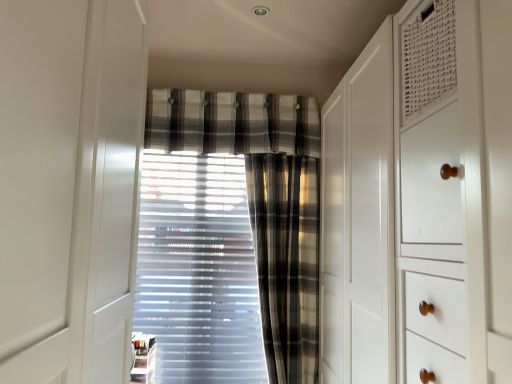
The image size is (512, 384). Describe the element at coordinates (286, 261) in the screenshot. I see `plaid fabric curtain at center, which is counted as the first curtain, starting from the right` at that location.

What is the approximate width of plaid fabric curtain at center, positioned as the 2th curtain in left-to-right order?

The width of plaid fabric curtain at center, positioned as the 2th curtain in left-to-right order, is 6.33 inches.

Image resolution: width=512 pixels, height=384 pixels. I want to click on plaid fabric curtain at center, which is the first curtain in left-to-right order, so click(x=230, y=236).

What do you see at coordinates (231, 122) in the screenshot?
I see `plaid fabric at center` at bounding box center [231, 122].

Find the location of a particular element. plaid fabric curtain at center, which is counted as the first curtain, starting from the right is located at coordinates (286, 261).

Does plaid fabric curtain at center, which is counted as the first curtain, starting from the right, have a lesser height compared to plaid fabric curtain at center, arranged as the 2th curtain when viewed from the right?

No.

Are plaid fabric curtain at center, which is counted as the first curtain, starting from the right, and plaid fabric curtain at center, arranged as the 2th curtain when viewed from the right, far apart?

No, plaid fabric curtain at center, which is counted as the first curtain, starting from the right, is not far away from plaid fabric curtain at center, arranged as the 2th curtain when viewed from the right.

Is plaid fabric curtain at center, positioned as the 2th curtain in left-to-right order, facing away from plaid fabric curtain at center, arranged as the 2th curtain when viewed from the right?

plaid fabric curtain at center, positioned as the 2th curtain in left-to-right order, is not turned away from plaid fabric curtain at center, arranged as the 2th curtain when viewed from the right.

Is plaid fabric curtain at center, which is the first curtain in left-to-right order, not within plaid fabric curtain at center, positioned as the 2th curtain in left-to-right order?

Yes, plaid fabric curtain at center, which is the first curtain in left-to-right order, is located beyond the bounds of plaid fabric curtain at center, positioned as the 2th curtain in left-to-right order.

Is plaid fabric curtain at center, which is the first curtain in left-to-right order, positioned with its back to plaid fabric curtain at center, positioned as the 2th curtain in left-to-right order?

No, plaid fabric curtain at center, which is the first curtain in left-to-right order,'s orientation is not away from plaid fabric curtain at center, positioned as the 2th curtain in left-to-right order.

Which is more to the left, plaid fabric curtain at center, which is the first curtain in left-to-right order, or plaid fabric curtain at center, which is counted as the first curtain, starting from the right?

plaid fabric curtain at center, which is the first curtain in left-to-right order.

Is plaid fabric curtain at center, which is the first curtain in left-to-right order, in front of or behind plaid fabric curtain at center, which is counted as the first curtain, starting from the right, in the image?

Clearly, plaid fabric curtain at center, which is the first curtain in left-to-right order, is behind plaid fabric curtain at center, which is counted as the first curtain, starting from the right.

You are a GUI agent. You are given a task and a screenshot of the screen. Output one action in this format:
    pyautogui.click(x=<x>, y=<y>)
    Task: Click on the curtain to the left of plaid fabric at center
    This screenshot has width=512, height=384.
    Given the screenshot: What is the action you would take?
    pyautogui.click(x=230, y=236)

From a real-world perspective, between plaid fabric curtain at center, arranged as the 2th curtain when viewed from the right, and plaid fabric at center, who is vertically lower?

From a 3D spatial view, plaid fabric curtain at center, arranged as the 2th curtain when viewed from the right, is below.

Could you tell me if plaid fabric curtain at center, arranged as the 2th curtain when viewed from the right, is turned towards plaid fabric at center?

No, plaid fabric curtain at center, arranged as the 2th curtain when viewed from the right, is not turned towards plaid fabric at center.

Considering the positions of points (308, 301) and (227, 118), is point (308, 301) closer to camera compared to point (227, 118)?

Yes, point (308, 301) is closer to viewer.

Considering the relative sizes of plaid fabric curtain at center, positioned as the 2th curtain in left-to-right order, and plaid fabric at center in the image provided, is plaid fabric curtain at center, positioned as the 2th curtain in left-to-right order, thinner than plaid fabric at center?

No, plaid fabric curtain at center, positioned as the 2th curtain in left-to-right order, is not thinner than plaid fabric at center.

Based on the photo, could you tell me if plaid fabric curtain at center, positioned as the 2th curtain in left-to-right order, is facing plaid fabric at center?

No, plaid fabric curtain at center, positioned as the 2th curtain in left-to-right order, is not turned towards plaid fabric at center.

Which of these two, plaid fabric curtain at center, positioned as the 2th curtain in left-to-right order, or plaid fabric at center, is smaller?

plaid fabric at center.

Does plaid fabric at center have a larger size compared to plaid fabric curtain at center, which is counted as the first curtain, starting from the right?

No, plaid fabric at center is not bigger than plaid fabric curtain at center, which is counted as the first curtain, starting from the right.

From a real-world perspective, which is physically below, plaid fabric at center or plaid fabric curtain at center, positioned as the 2th curtain in left-to-right order?

From a 3D spatial view, plaid fabric curtain at center, positioned as the 2th curtain in left-to-right order, is below.

From the image's perspective, is plaid fabric at center on plaid fabric curtain at center, positioned as the 2th curtain in left-to-right order?

Yes.

Is plaid fabric at center not within plaid fabric curtain at center, positioned as the 2th curtain in left-to-right order?

Yes, plaid fabric at center is outside of plaid fabric curtain at center, positioned as the 2th curtain in left-to-right order.

Would you say plaid fabric at center is outside plaid fabric curtain at center, arranged as the 2th curtain when viewed from the right?

Yes, plaid fabric at center is outside of plaid fabric curtain at center, arranged as the 2th curtain when viewed from the right.

Could you measure the distance between plaid fabric at center and plaid fabric curtain at center, arranged as the 2th curtain when viewed from the right?

They are 12.41 inches apart.

Is plaid fabric at center smaller than plaid fabric curtain at center, arranged as the 2th curtain when viewed from the right?

Yes.

From the image's perspective, which is above, plaid fabric at center or plaid fabric curtain at center, which is the first curtain in left-to-right order?

plaid fabric at center, from the image's perspective.

I want to click on curtain below the plaid fabric curtain at center, positioned as the 2th curtain in left-to-right order (from a real-world perspective), so click(x=230, y=236).

Where is `curtain in front of the plaid fabric curtain at center, which is the first curtain in left-to-right order`? The image size is (512, 384). curtain in front of the plaid fabric curtain at center, which is the first curtain in left-to-right order is located at coordinates (286, 261).

In the scene shown: Estimate the real-world distances between objects in this image. Which object is closer to plaid fabric at center, plaid fabric curtain at center, arranged as the 2th curtain when viewed from the right, or plaid fabric curtain at center, positioned as the 2th curtain in left-to-right order?

plaid fabric curtain at center, arranged as the 2th curtain when viewed from the right.

Based on their spatial positions, is plaid fabric curtain at center, which is the first curtain in left-to-right order, or plaid fabric at center further from plaid fabric curtain at center, which is counted as the first curtain, starting from the right?

Based on the image, plaid fabric at center appears to be further to plaid fabric curtain at center, which is counted as the first curtain, starting from the right.

Looking at the image, which one is located further to plaid fabric at center, plaid fabric curtain at center, positioned as the 2th curtain in left-to-right order, or plaid fabric curtain at center, arranged as the 2th curtain when viewed from the right?

Based on the image, plaid fabric curtain at center, positioned as the 2th curtain in left-to-right order, appears to be further to plaid fabric at center.

Looking at the image, which one is located further to plaid fabric curtain at center, arranged as the 2th curtain when viewed from the right, plaid fabric curtain at center, positioned as the 2th curtain in left-to-right order, or plaid fabric at center?

plaid fabric at center lies further to plaid fabric curtain at center, arranged as the 2th curtain when viewed from the right, than the other object.

When comparing their distances from plaid fabric curtain at center, arranged as the 2th curtain when viewed from the right, does plaid fabric at center or plaid fabric curtain at center, positioned as the 2th curtain in left-to-right order, seem further?

plaid fabric at center is further to plaid fabric curtain at center, arranged as the 2th curtain when viewed from the right.

Based on the photo, based on their spatial positions, is plaid fabric at center or plaid fabric curtain at center, arranged as the 2th curtain when viewed from the right, closer to plaid fabric curtain at center, which is counted as the first curtain, starting from the right?

Among the two, plaid fabric curtain at center, arranged as the 2th curtain when viewed from the right, is located nearer to plaid fabric curtain at center, which is counted as the first curtain, starting from the right.

The image size is (512, 384). Find the location of `curtain that lies between plaid fabric at center and plaid fabric curtain at center, arranged as the 2th curtain when viewed from the right, from top to bottom`. curtain that lies between plaid fabric at center and plaid fabric curtain at center, arranged as the 2th curtain when viewed from the right, from top to bottom is located at coordinates (286, 261).